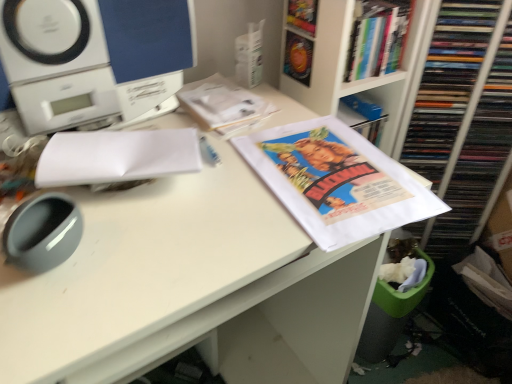
This screenshot has width=512, height=384. In order to click on vacant space situated above white paper at center (from a real-world perspective) in this screenshot , I will do coord(194,195).